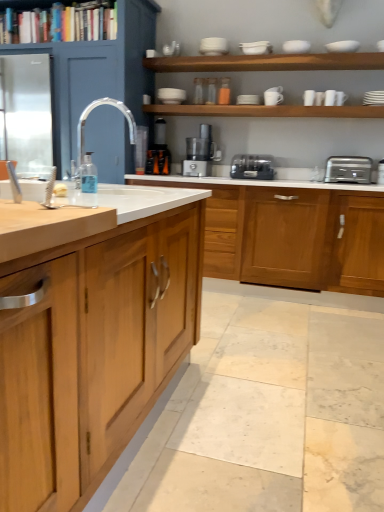
Question: Considering the relative positions of white ceramic cup at upper center, the fifth tableware in the right-to-left sequence, and wooden shelf at upper center, acting as the 3th shelf starting from the top, in the image provided, is white ceramic cup at upper center, the fifth tableware in the right-to-left sequence, to the left of wooden shelf at upper center, acting as the 3th shelf starting from the top, from the viewer's perspective?

Choices:
 (A) no
 (B) yes

Answer: (A)

Question: Is white ceramic cup at upper center, the fifth tableware in the right-to-left sequence, bigger than wooden shelf at upper center, marked as the first shelf in a bottom-to-top arrangement?

Choices:
 (A) no
 (B) yes

Answer: (A)

Question: Considering the relative sizes of white ceramic cup at upper center, the fifth tableware in the right-to-left sequence, and wooden shelf at upper center, marked as the first shelf in a bottom-to-top arrangement, in the image provided, is white ceramic cup at upper center, the fifth tableware in the right-to-left sequence, thinner than wooden shelf at upper center, marked as the first shelf in a bottom-to-top arrangement,?

Choices:
 (A) no
 (B) yes

Answer: (B)

Question: Is the position of white ceramic cup at upper center, the fifth tableware in the right-to-left sequence, more distant than that of wooden shelf at upper center, acting as the 3th shelf starting from the top?

Choices:
 (A) yes
 (B) no

Answer: (A)

Question: Is white ceramic cup at upper center, which is counted as the seventh tableware, starting from the left, taller than wooden shelf at upper center, marked as the first shelf in a bottom-to-top arrangement?

Choices:
 (A) no
 (B) yes

Answer: (B)

Question: Is transparent plastic soap dispenser at sink in front of or behind wooden shelf at upper center, acting as the 3th shelf starting from the top, in the image?

Choices:
 (A) behind
 (B) front

Answer: (B)

Question: Which is correct: transparent plastic soap dispenser at sink is inside wooden shelf at upper center, marked as the first shelf in a bottom-to-top arrangement, or outside of it?

Choices:
 (A) outside
 (B) inside

Answer: (A)

Question: From the image's perspective, relative to wooden shelf at upper center, acting as the 3th shelf starting from the top, is transparent plastic soap dispenser at sink above or below?

Choices:
 (A) below
 (B) above

Answer: (A)

Question: From a real-world perspective, is transparent plastic soap dispenser at sink positioned above or below wooden shelf at upper center, marked as the first shelf in a bottom-to-top arrangement?

Choices:
 (A) above
 (B) below

Answer: (B)

Question: Is wooden shelf at upper center, acting as the 3th shelf starting from the top, inside the boundaries of wooden cabinet at left, or outside?

Choices:
 (A) outside
 (B) inside

Answer: (A)

Question: From a real-world perspective, is wooden shelf at upper center, marked as the first shelf in a bottom-to-top arrangement, positioned above or below wooden cabinet at left?

Choices:
 (A) below
 (B) above

Answer: (A)

Question: Relative to wooden cabinet at left, is wooden shelf at upper center, acting as the 3th shelf starting from the top, in front or behind?

Choices:
 (A) front
 (B) behind

Answer: (B)

Question: Considering the positions of wooden shelf at upper center, marked as the first shelf in a bottom-to-top arrangement, and wooden cabinet at left in the image, is wooden shelf at upper center, marked as the first shelf in a bottom-to-top arrangement, taller or shorter than wooden cabinet at left?

Choices:
 (A) tall
 (B) short

Answer: (B)

Question: Is white matte bowl at upper center, the tenth tableware viewed from the right, wider or thinner than wooden shelf at upper center, marked as the first shelf in a bottom-to-top arrangement?

Choices:
 (A) thin
 (B) wide

Answer: (A)

Question: Relative to wooden shelf at upper center, acting as the 3th shelf starting from the top, is white matte bowl at upper center, the tenth tableware viewed from the right, in front or behind?

Choices:
 (A) front
 (B) behind

Answer: (B)